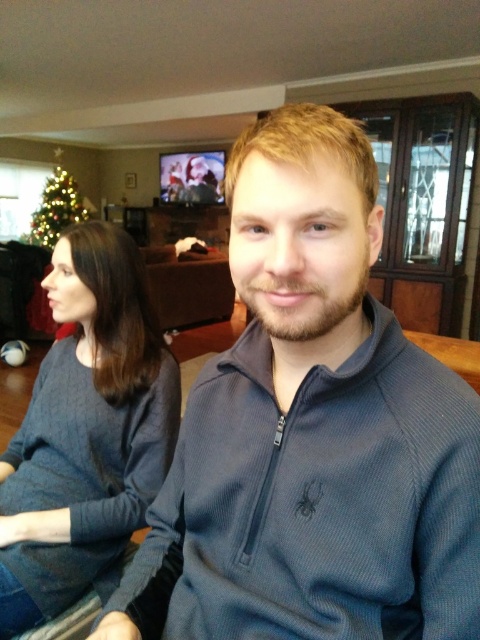
You are a photographer setting up for a family portrait in the living room. You need to ensure that both the dark gray sweater at left and the green matte christmas tree at left are visible in the frame. Based on their positions, which object is closer to the camera?

The dark gray sweater at left is positioned on the right side of the green matte christmas tree at left, meaning it is closer to the camera than the tree.

Based on the photo, you are a photographer setting up for a group photo in this living room. You need to ensure that both the dark gray sweater at left and the green matte christmas tree at left are in focus. Given that your camera has a depth of field range of 5 meters, will both objects be in focus?

The dark gray sweater at left is 5.80 meters from the green matte christmas tree at left. Since the distance between them exceeds the camera depth of field range of 5 meters, both objects cannot be in focus simultaneously.